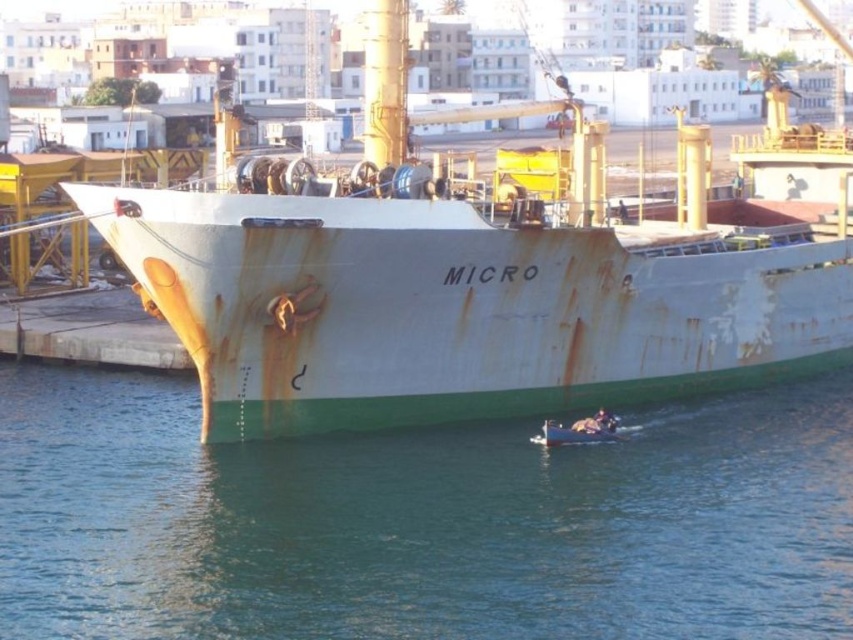
Can you confirm if rusty metal ship at center is shorter than rusty metal boat at lower center?

Incorrect, rusty metal ship at center's height does not fall short of rusty metal boat at lower center's.

Between point (560, 397) and point (561, 429), which one is positioned in front?

Point (561, 429) is more forward.

What do you see at coordinates (486, 273) in the screenshot?
I see `rusty metal ship at center` at bounding box center [486, 273].

Identify the location of rusty metal ship at center. This screenshot has height=640, width=853. (486, 273).

Looking at this image, is the position of green matte water at lower center less distant than that of rusty metal ship at center?

That is True.

This screenshot has width=853, height=640. In order to click on green matte water at lower center in this screenshot , I will do `click(419, 522)`.

Between green matte water at lower center and rusty metal boat at lower center, which one has more height?

green matte water at lower center

Does green matte water at lower center have a lesser width compared to rusty metal boat at lower center?

In fact, green matte water at lower center might be wider than rusty metal boat at lower center.

Is point (280, 513) closer to viewer compared to point (595, 412)?

Yes.

In order to click on green matte water at lower center in this screenshot , I will do `click(419, 522)`.